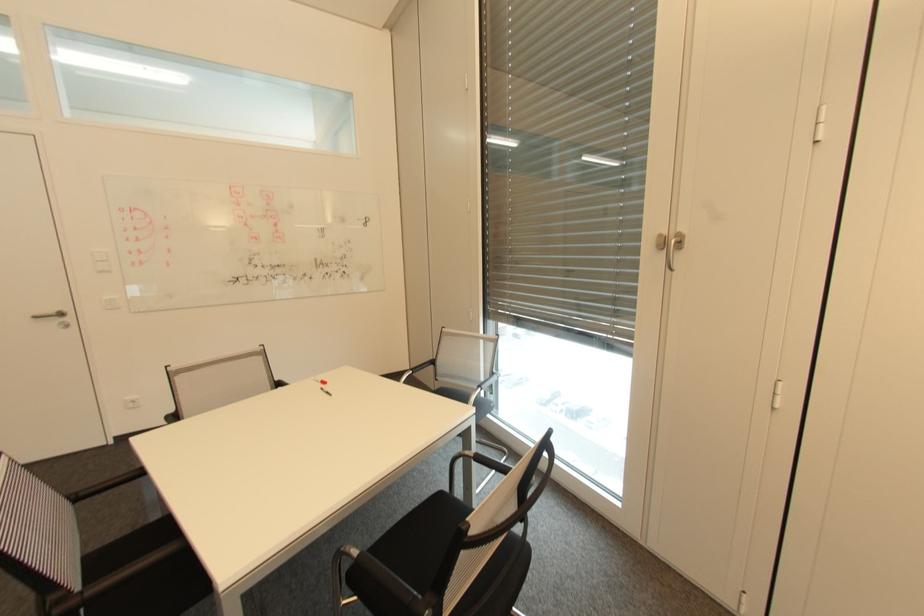
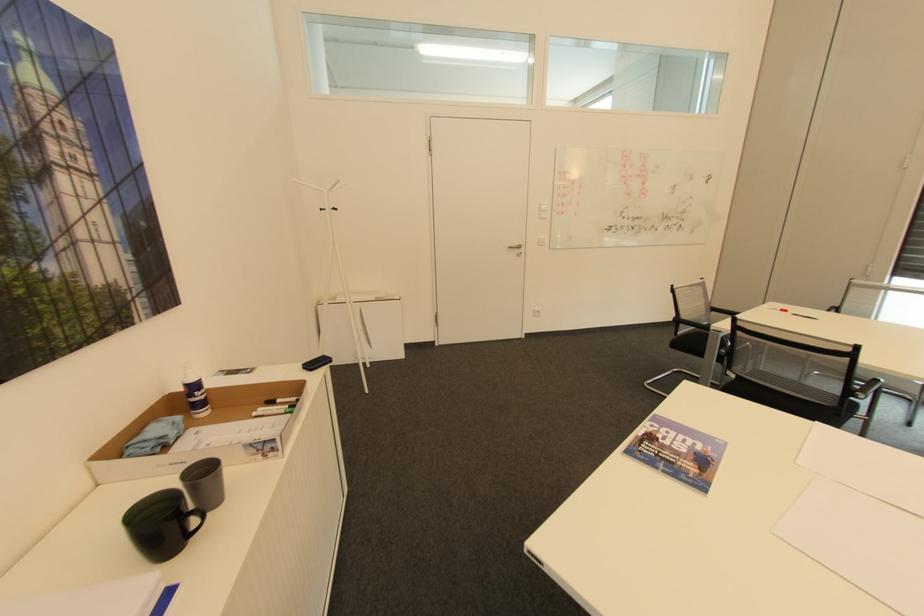
Locate, in the second image, the point that corresponds to pixel 67 314 in the first image.

(524, 246)